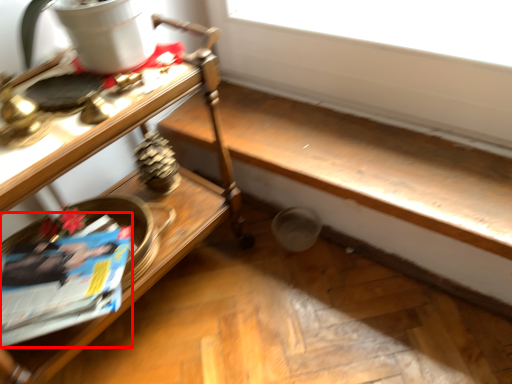
Question: From the image's perspective, where is magazine (annotated by the red box) located in relation to table in the image?

Choices:
 (A) below
 (B) above

Answer: (A)